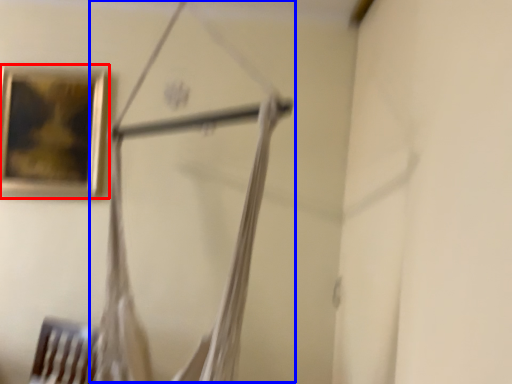
Question: Which object is further to the camera taking this photo, picture frame (highlighted by a red box) or hanger (highlighted by a blue box)?

Choices:
 (A) picture frame
 (B) hanger

Answer: (A)